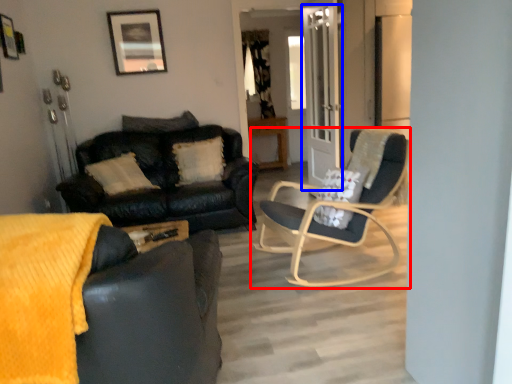
Question: Which of the following is the farthest to the observer, chair (highlighted by a red box) or glass door (highlighted by a blue box)?

Choices:
 (A) chair
 (B) glass door

Answer: (B)